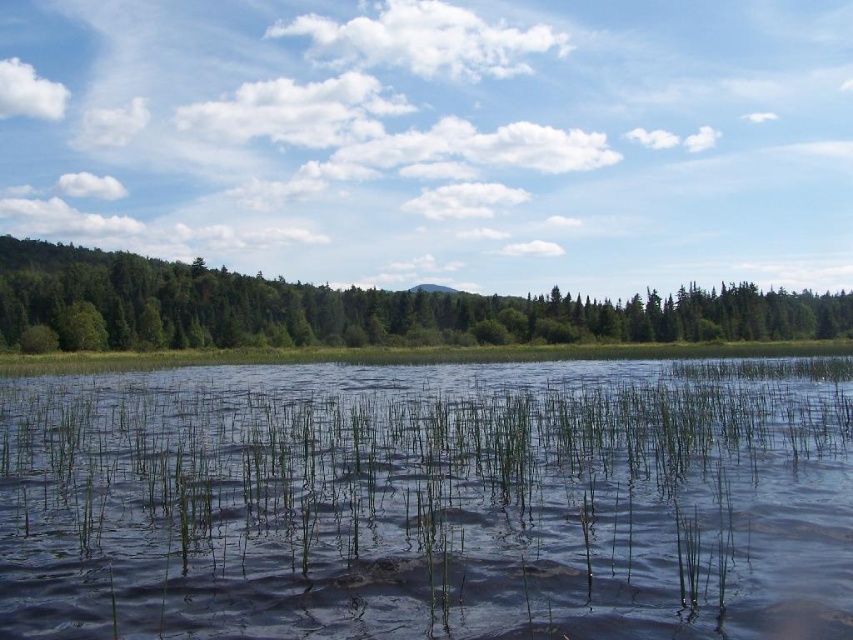
Which is in front, point (622, 621) or point (503, 333)?

Positioned in front is point (622, 621).

Looking at this image, who is more distant from viewer, (689,577) or (383,333)?

Positioned behind is point (383,333).

Who is more forward, (483, 576) or (265, 292)?

Point (483, 576) is in front.

Locate an element on the screen. This screenshot has width=853, height=640. green grassy water at center is located at coordinates (430, 500).